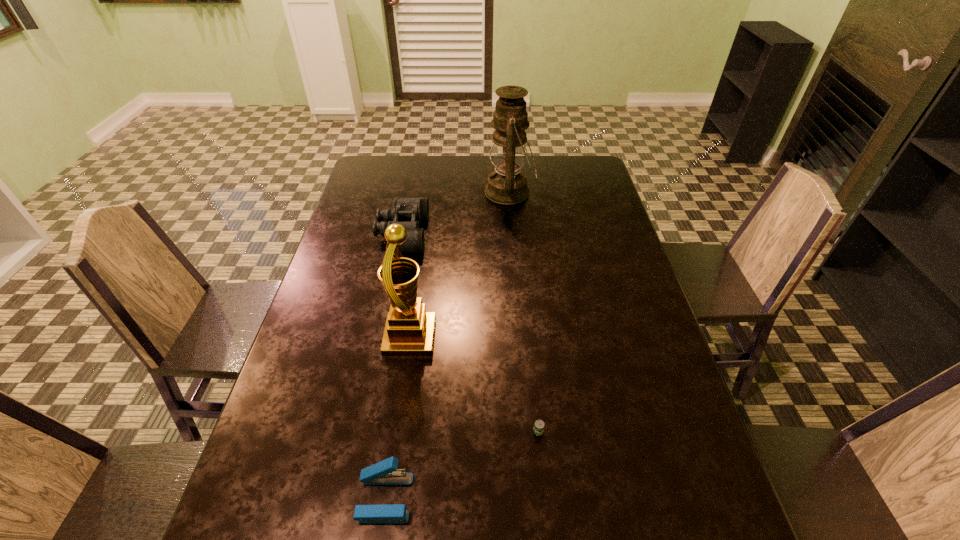
You are a GUI agent. You are given a task and a screenshot of the screen. Output one action in this format:
    pyautogui.click(x=<x>, y=<y>)
    Task: Click on the vacant space located 0.260m on the back of the fourth tallest object
    This screenshot has width=960, height=540.
    Given the screenshot: What is the action you would take?
    pyautogui.click(x=404, y=364)

In order to click on free space located 0.050m on the back of the fourth farthest object in this screenshot , I will do `click(536, 403)`.

The image size is (960, 540). In order to click on object at the far edge in this screenshot , I will do `click(507, 185)`.

This screenshot has height=540, width=960. I want to click on object that is at the left edge, so click(409, 212).

Identify the location of vacant space at the far edge of the desktop. The height and width of the screenshot is (540, 960). (492, 168).

The image size is (960, 540). In the image, there is a desktop. Identify the location of vacant area at the left edge. (359, 229).

Locate an element on the screen. Image resolution: width=960 pixels, height=540 pixels. vacant space at the right edge of the desktop is located at coordinates (573, 226).

Identify the location of free space at the far right corner of the desktop. This screenshot has width=960, height=540. (575, 173).

You are a GUI agent. You are given a task and a screenshot of the screen. Output one action in this format:
    pyautogui.click(x=<x>, y=<y>)
    Task: Click on the free spot between the binoculars and the oil lamp
    This screenshot has height=540, width=960.
    Given the screenshot: What is the action you would take?
    pyautogui.click(x=456, y=213)

This screenshot has height=540, width=960. I want to click on free point between the binoculars and the fourth farthest object, so click(x=470, y=332).